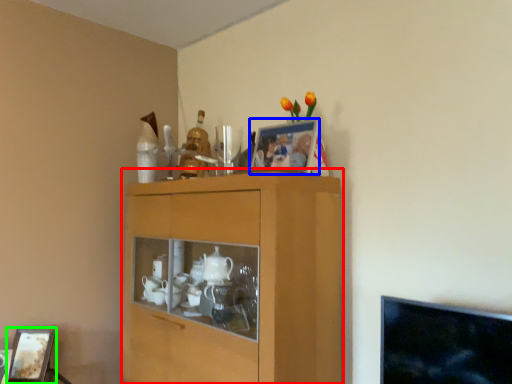
Question: Which object is positioned closest to cabinetry (highlighted by a red box)? Select from picture frame (highlighted by a blue box) and picture frame (highlighted by a green box).

Choices:
 (A) picture frame
 (B) picture frame

Answer: (A)